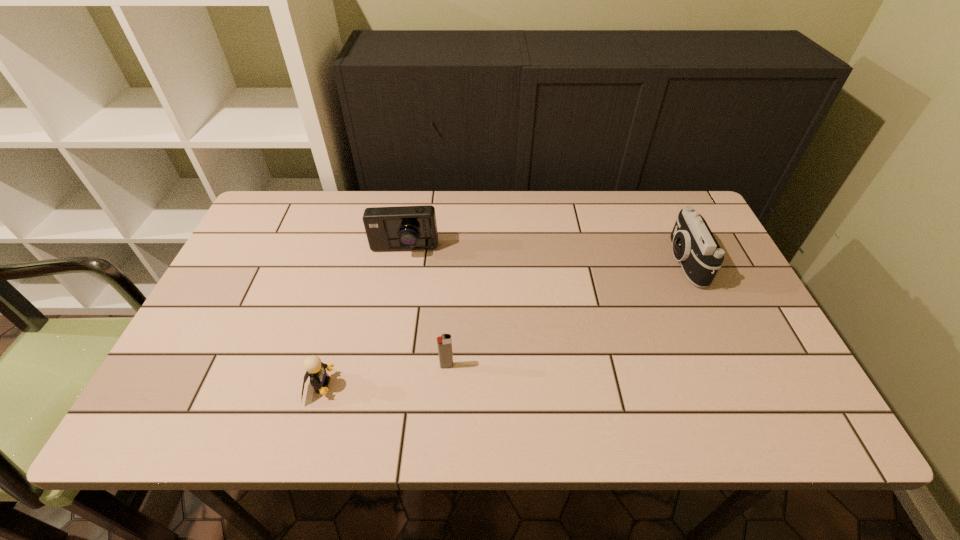
Locate an element on the screen. the right camera is located at coordinates tap(693, 243).

You are a GUI agent. You are given a task and a screenshot of the screen. Output one action in this format:
    pyautogui.click(x=<x>, y=<y>)
    Task: Click on the left camera
    Image resolution: width=960 pixels, height=540 pixels.
    Given the screenshot: What is the action you would take?
    pyautogui.click(x=404, y=227)

Find the location of a particular element. igniter is located at coordinates (444, 342).

Identify the location of Lego. The height and width of the screenshot is (540, 960). (316, 370).

Where is `vacant space located on the front lens of the right camera`? Image resolution: width=960 pixels, height=540 pixels. vacant space located on the front lens of the right camera is located at coordinates (537, 261).

Identify the location of vacant space located on the front lens of the right camera. The width and height of the screenshot is (960, 540). (638, 261).

Where is `free point located on the front lens of the right camera`? free point located on the front lens of the right camera is located at coordinates (602, 261).

Where is `blank space located 0.130m on the front-facing side of the left camera`? This screenshot has height=540, width=960. blank space located 0.130m on the front-facing side of the left camera is located at coordinates (396, 295).

This screenshot has width=960, height=540. Find the location of `free space located 0.060m on the right of the igniter`. free space located 0.060m on the right of the igniter is located at coordinates (480, 366).

The width and height of the screenshot is (960, 540). In order to click on free space located on the front-facing side of the leftmost object in this screenshot , I will do `click(496, 386)`.